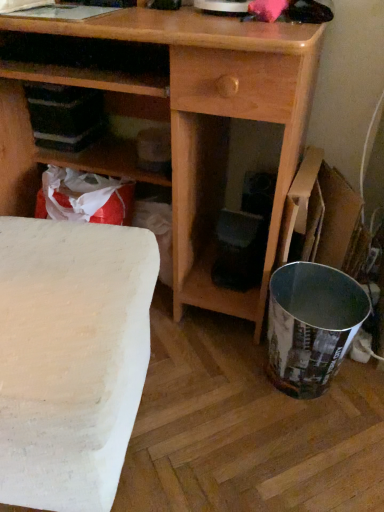
Question: Can you confirm if wooden desk at center is shorter than white matte table at lower left?

Choices:
 (A) yes
 (B) no

Answer: (B)

Question: From the image's perspective, would you say wooden desk at center is shown under white matte table at lower left?

Choices:
 (A) no
 (B) yes

Answer: (A)

Question: Can you confirm if wooden desk at center is thinner than white matte table at lower left?

Choices:
 (A) yes
 (B) no

Answer: (B)

Question: From the image's perspective, is wooden desk at center over white matte table at lower left?

Choices:
 (A) no
 (B) yes

Answer: (B)

Question: Considering the relative sizes of wooden desk at center and white matte table at lower left in the image provided, is wooden desk at center bigger than white matte table at lower left?

Choices:
 (A) yes
 (B) no

Answer: (A)

Question: Do you think white matte table at lower left is within wooden desk at center, or outside of it?

Choices:
 (A) outside
 (B) inside

Answer: (A)

Question: Considering the positions of white matte table at lower left and wooden desk at center in the image, is white matte table at lower left taller or shorter than wooden desk at center?

Choices:
 (A) short
 (B) tall

Answer: (A)

Question: Is point (132, 288) closer or farther from the camera than point (21, 31)?

Choices:
 (A) farther
 (B) closer

Answer: (B)

Question: From the image's perspective, relative to wooden desk at center, is white matte table at lower left above or below?

Choices:
 (A) above
 (B) below

Answer: (B)

Question: Is white matte table at lower left bigger or smaller than cardboard box at right?

Choices:
 (A) small
 (B) big

Answer: (B)

Question: Considering the positions of point (8, 432) and point (360, 208), is point (8, 432) closer or farther from the camera than point (360, 208)?

Choices:
 (A) closer
 (B) farther

Answer: (A)

Question: Is white matte table at lower left taller or shorter than cardboard box at right?

Choices:
 (A) tall
 (B) short

Answer: (A)

Question: Relative to cardboard box at right, is white matte table at lower left in front or behind?

Choices:
 (A) front
 (B) behind

Answer: (A)

Question: From their relative heights in the image, would you say cardboard box at right is taller or shorter than wooden desk at center?

Choices:
 (A) short
 (B) tall

Answer: (A)

Question: Is cardboard box at right inside the boundaries of wooden desk at center, or outside?

Choices:
 (A) inside
 (B) outside

Answer: (B)